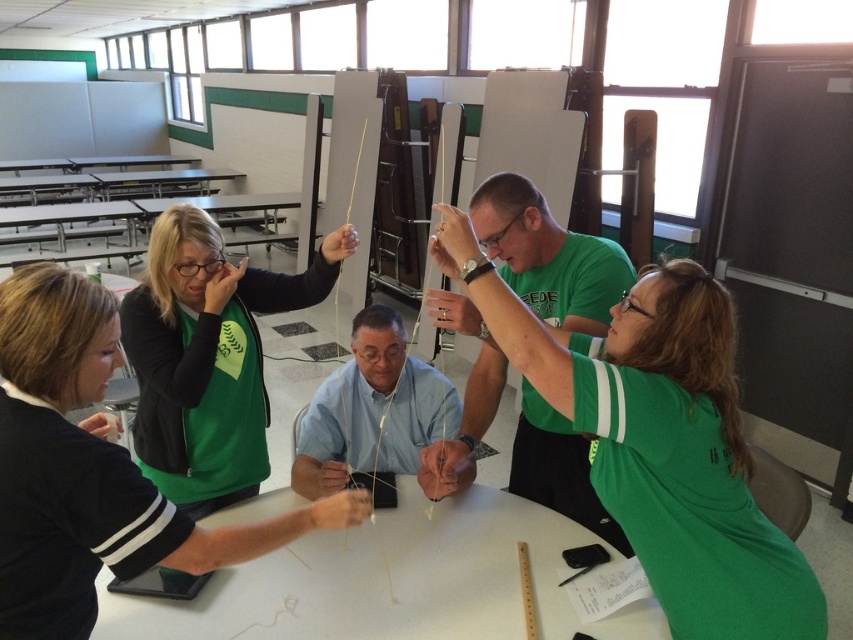
You are a photographer standing in the classroom and want to take a photo of the green matte shirt at upper right and the green fabric table at upper center. Which object should you focus on first if you want to capture both in the same frame without moving the camera?

The green matte shirt at upper right is much taller than the green fabric table at upper center, so you should focus on the green matte shirt at upper right first to ensure it is fully in frame.

Consider the image. You are organizing a group activity for six people in the classroom. The white matte round table at center and the metallic silver table at upper left are available. Which table should you choose to accommodate everyone comfortably?

The white matte round table at center has a larger width than the metallic silver table at upper left, so it can comfortably accommodate six people.